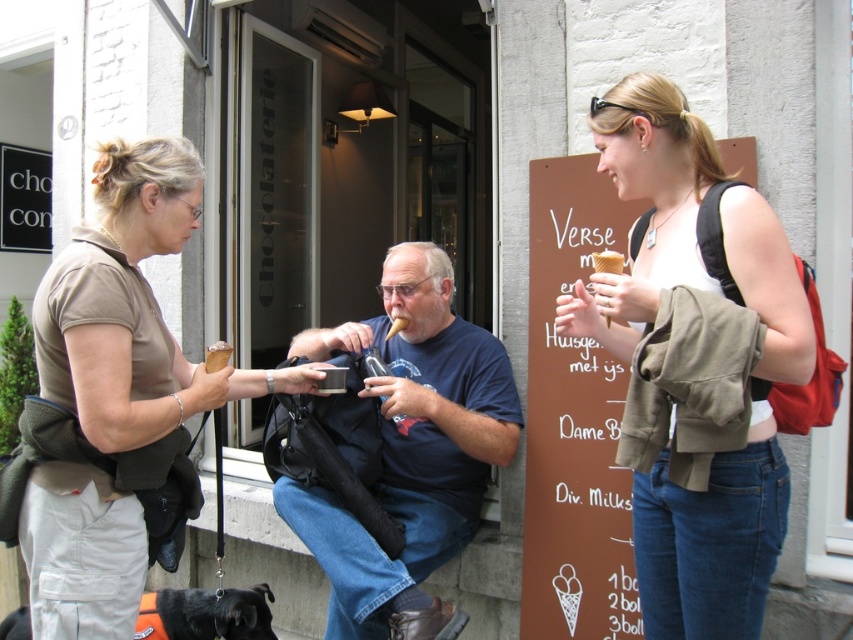
You are a customer at the chocolaterie. You see the matte white ice cream cone at center and the matte brown shirt at left. Which object is higher up in the image?

The matte white ice cream cone at center is above the matte brown shirt at left, so it is higher up in the image.

You are standing in front of the chocolaterie and want to take a photo of the two points marked in the scene. Which point, point 1 at coordinates (749, 481) or point 2 at coordinates (345, 600), will appear larger in your camera view?

Point 1 at coordinates (749, 481) will appear larger in the camera view because it is closer to the camera than point 2 at coordinates (345, 600).